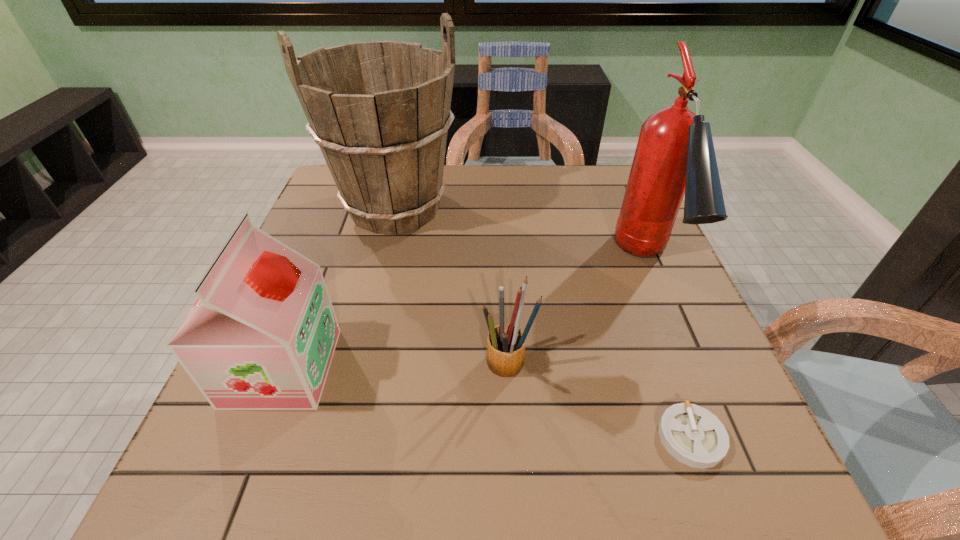
Identify the location of vacant space situated on the left of the shortest object. (501, 437).

I want to click on object that is at the far edge, so click(380, 112).

You are a GUI agent. You are given a task and a screenshot of the screen. Output one action in this format:
    pyautogui.click(x=<x>, y=<y>)
    Task: Click on the object positioned at the near edge
    
    Given the screenshot: What is the action you would take?
    pyautogui.click(x=694, y=436)

You are a GUI agent. You are given a task and a screenshot of the screen. Output one action in this format:
    pyautogui.click(x=<x>, y=<y>)
    Task: Click on the bucket situated at the left edge
    The height and width of the screenshot is (540, 960).
    Given the screenshot: What is the action you would take?
    pyautogui.click(x=380, y=112)

Where is `soya milk at the left edge`? This screenshot has width=960, height=540. soya milk at the left edge is located at coordinates (261, 335).

Find the location of a particular element. This screenshot has height=540, width=960. fire extinguisher present at the right edge is located at coordinates (675, 156).

Identify the location of ashtray that is positioned at the right edge. (694, 436).

This screenshot has width=960, height=540. I want to click on object that is at the far left corner, so click(380, 112).

This screenshot has height=540, width=960. What are the coordinates of `object present at the near right corner` in the screenshot? It's located at (694, 436).

Locate an element on the screen. vacant space at the far edge of the desktop is located at coordinates (578, 198).